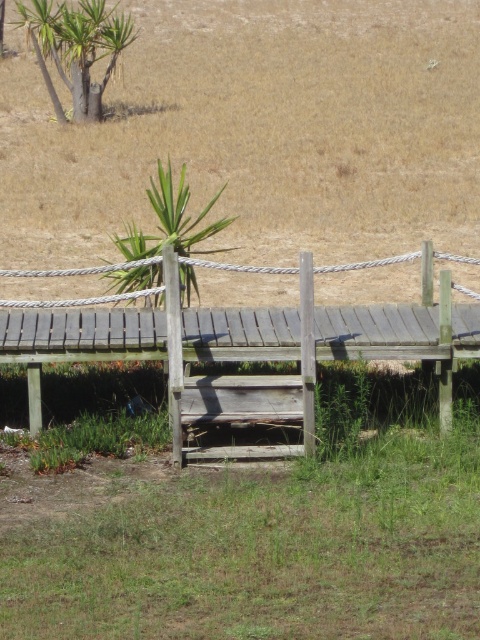
You are standing on the rustic wooden bridge and looking down. You see the green grassy at lower center and the green leafy plant at center. Which one is closer to you?

The green grassy at lower center is closer to you because it is positioned in front of the green leafy plant at center.

You are standing on the rustic wooden bridge and notice two green areas. The first is the green grassy at lower center and the second is the green leafy plant at center. Which of these two areas is positioned to the right side of the other?

The green grassy at lower center is to the right of the green leafy plant at center.

In the scene shown: You are standing on the rustic wooden bridge and want to know the exact 2D coordinates of the brown grassy field at center in the image. What are they?

The brown grassy field at center is located at the 2D coordinates of point (260, 132).